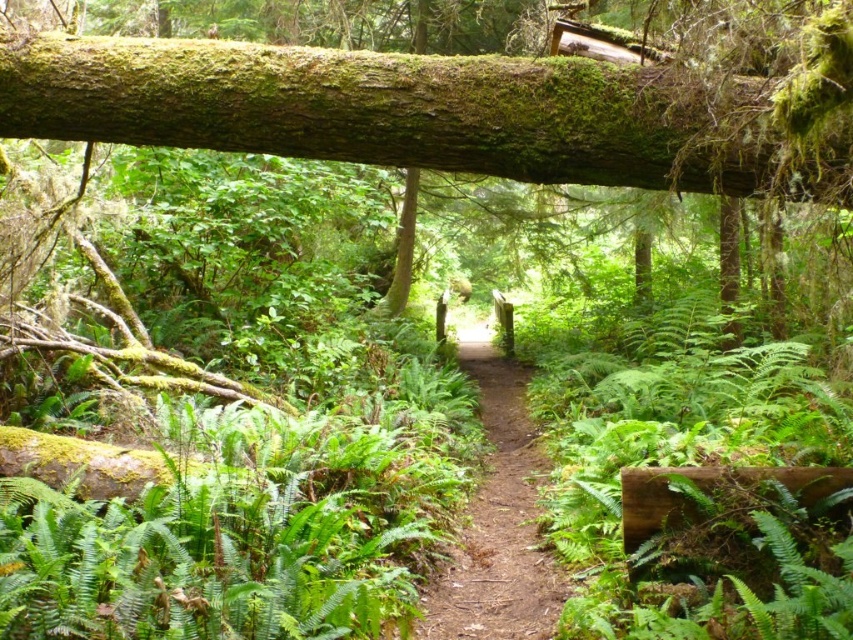
You are a hiker trying to cross the narrow dirt path in the forest. There are two green mossy logs blocking your way. The first is the green mossy log at upper center and the second is the green mossy log at center. Which log should you climb over first?

You should climb over the green mossy log at upper center first because it is smaller than the green mossy log at center, making it easier to navigate.

You are a hiker who wants to cross the green mossy log at upper center. The log is located at coordinates point (419, 113). Is the log positioned above or below the dirt path?

The point (419, 113) corresponds to the green mossy log at upper center, which is positioned above the dirt path.